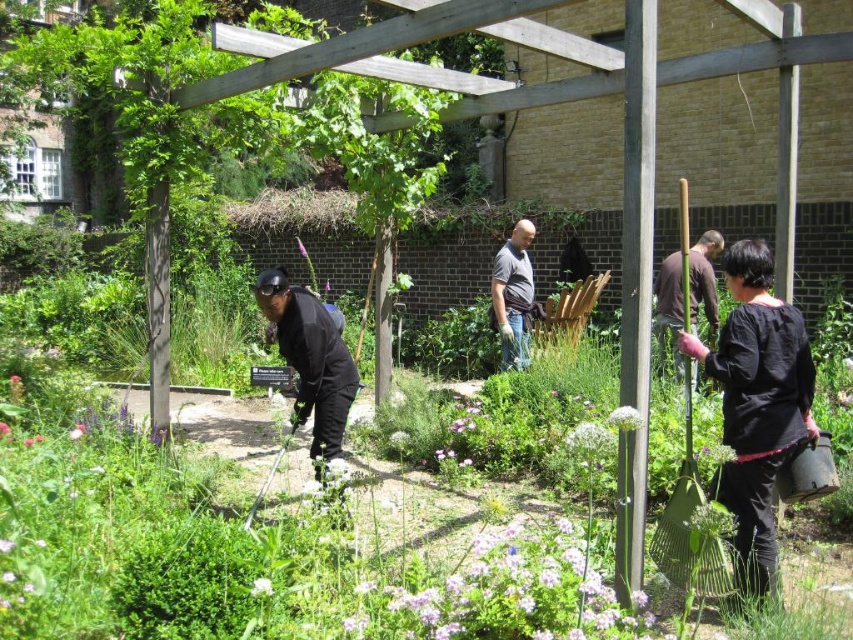
You are a visitor in the garden and notice two items hanging on the wooden pergola. The items are the black matte shirt at lower right and the black matte jacket at lower left. Which one is higher up?

The black matte shirt at lower right is taller than the black matte jacket at lower left, so the black matte shirt at lower right is higher up.

You are standing in the garden and want to hand a tool to both the person wearing the brown fabric shirt at right and the dark gray shirt at center. Which person should you approach first to ensure you can reach them without moving too far from your current position?

You should approach the brown fabric shirt at right first because it is closer to you than the dark gray shirt at center, so you can reach them without moving as much.